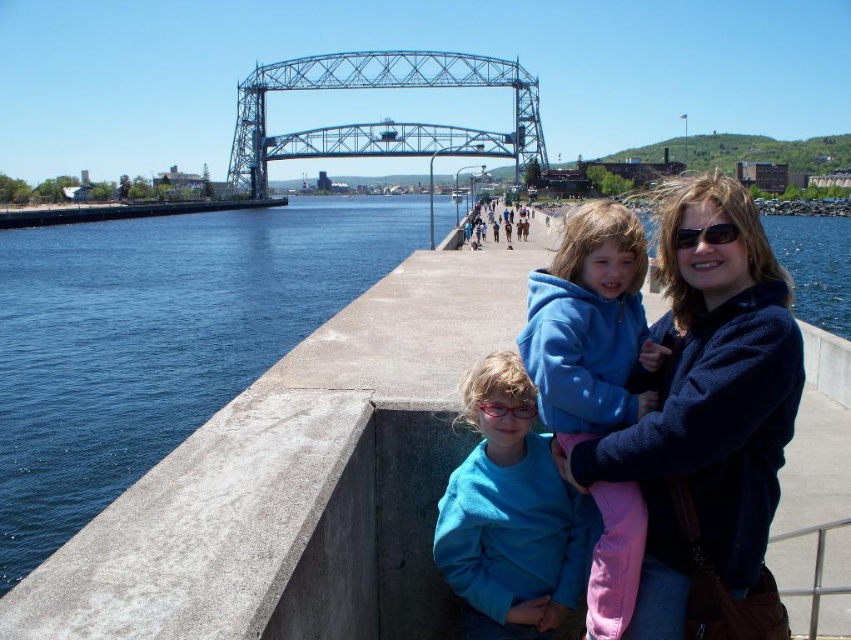
Question: Among these objects, which one is nearest to the camera?

Choices:
 (A) blue metallic bridge at center
 (B) blue concrete water at left
 (C) blue fleece jacket at center
 (D) matte blue sweater at center

Answer: (C)

Question: Does blue concrete water at left appear over dark blue fleece at center?

Choices:
 (A) no
 (B) yes

Answer: (B)

Question: Among these points, which one is farthest from the camera?

Choices:
 (A) (680, 240)
 (B) (780, 417)
 (C) (67, 417)
 (D) (463, 580)

Answer: (C)

Question: Is blue fleece jacket at center bigger than sunglasses at center?

Choices:
 (A) yes
 (B) no

Answer: (A)

Question: Based on their relative distances, which object is farther from the blue metallic bridge at center?

Choices:
 (A) blue concrete water at left
 (B) silver metallic rail at lower right
 (C) blue fleece jacket at center
 (D) matte blue sweater at center

Answer: (B)

Question: Does dark blue fleece at center appear on the left side of blue fleece jacket at center?

Choices:
 (A) no
 (B) yes

Answer: (A)